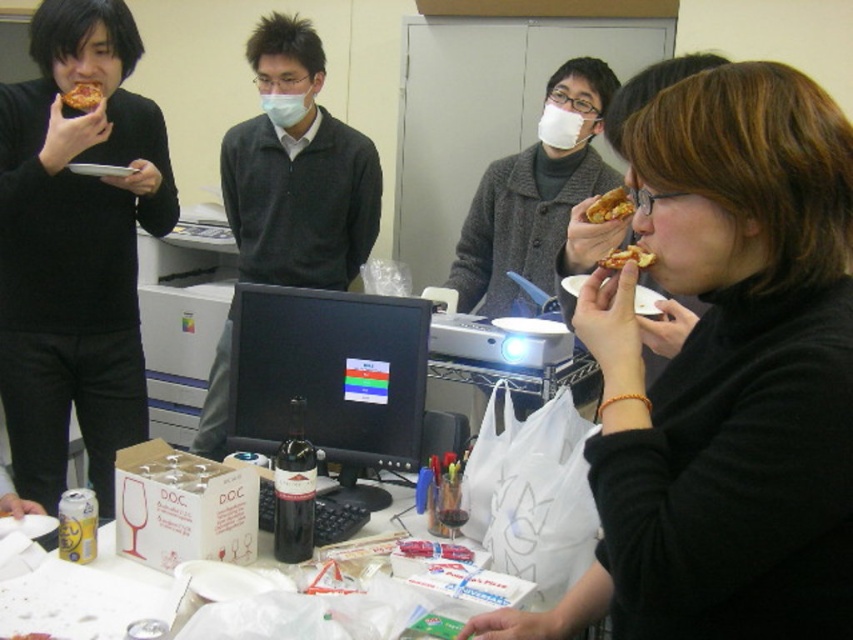
Question: Estimate the real-world distances between objects in this image. Which object is farther from the black glossy monitor at center?

Choices:
 (A) slightly crispy golden-brown pizza slice at upper right
 (B) golden crispy pizza at upper right
 (C) matte blue mask at center

Answer: (C)

Question: Which object is farther from the camera taking this photo?

Choices:
 (A) matte black pizza at center
 (B) golden crispy pizza slice at upper left

Answer: (B)

Question: From the image, what is the correct spatial relationship of matte gray sweater at center in relation to white matte mask at center?

Choices:
 (A) left
 (B) right

Answer: (A)

Question: From the image, what is the correct spatial relationship of white paper plates at center in relation to slightly crispy golden-brown pizza slice at upper right?

Choices:
 (A) below
 (B) above

Answer: (A)

Question: Which point is closer to the camera?

Choices:
 (A) slightly crispy golden-brown pizza slice at upper right
 (B) black glossy monitor at center
 (C) golden crispy pizza slice at upper left
 (D) matte black sweater at left

Answer: (A)

Question: Considering the relative positions of matte blue mask at center and slightly crispy golden-brown pizza slice at upper right in the image provided, where is matte blue mask at center located with respect to slightly crispy golden-brown pizza slice at upper right?

Choices:
 (A) below
 (B) above

Answer: (B)